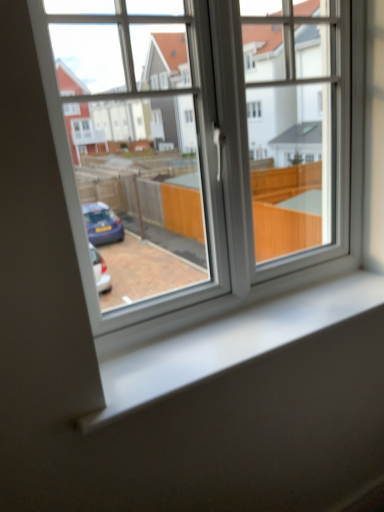
Where is `blank space above white glossy window sill at center (from a real-world perspective)`? The image size is (384, 512). blank space above white glossy window sill at center (from a real-world perspective) is located at coordinates (261, 326).